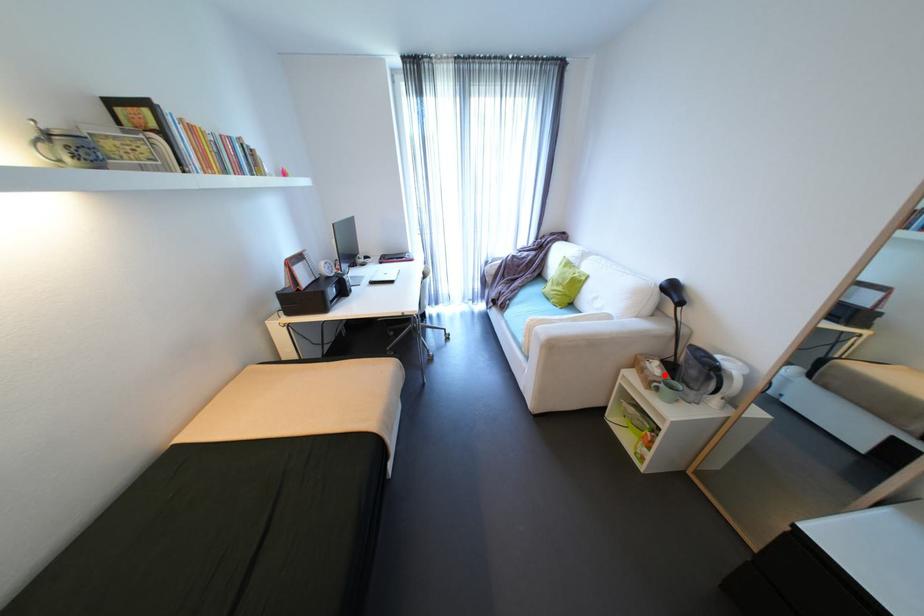
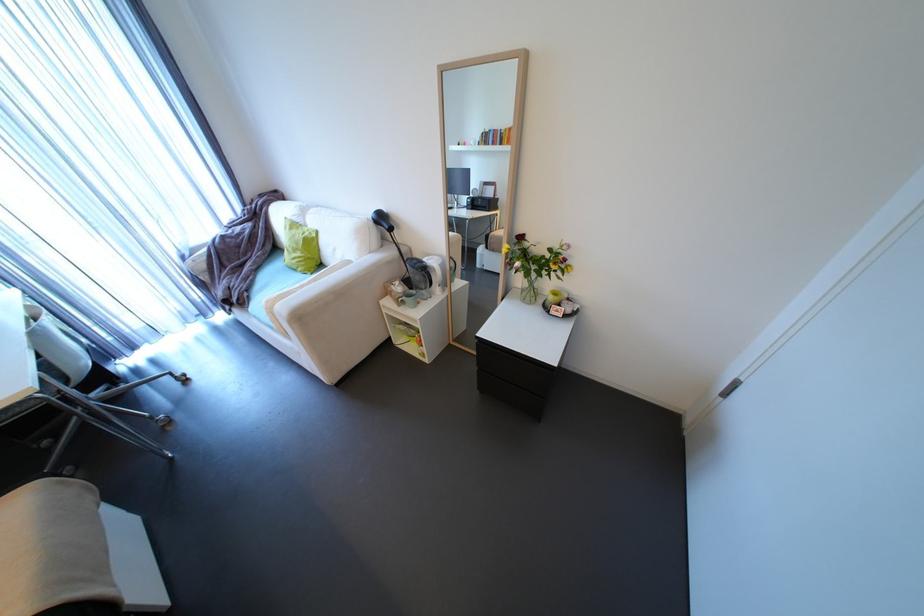
Find the pixel in the second image that matches the highlighted location in the first image.

(407, 292)